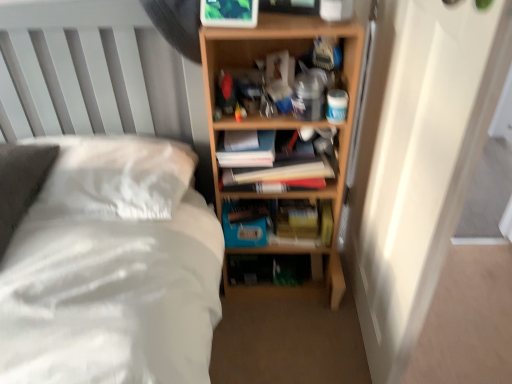
Question: From the image's perspective, is white soft bed at center under blue matte paperback book at center?

Choices:
 (A) no
 (B) yes

Answer: (B)

Question: Is white soft bed at center further to camera compared to blue matte paperback book at center?

Choices:
 (A) yes
 (B) no

Answer: (B)

Question: Is white soft bed at center bigger than blue matte paperback book at center?

Choices:
 (A) no
 (B) yes

Answer: (B)

Question: From a real-world perspective, does white soft bed at center sit lower than blue matte paperback book at center?

Choices:
 (A) no
 (B) yes

Answer: (A)

Question: Considering the relative sizes of white soft bed at center and blue matte paperback book at center in the image provided, is white soft bed at center taller than blue matte paperback book at center?

Choices:
 (A) yes
 (B) no

Answer: (A)

Question: Is blue matte paperback book at center at the back of white soft bed at center?

Choices:
 (A) no
 (B) yes

Answer: (A)

Question: Is white soft bed at center positioned behind wooden bookshelf at center?

Choices:
 (A) yes
 (B) no

Answer: (B)

Question: Is white soft bed at center bigger than wooden bookshelf at center?

Choices:
 (A) yes
 (B) no

Answer: (A)

Question: From the image's perspective, is white soft bed at center located above wooden bookshelf at center?

Choices:
 (A) yes
 (B) no

Answer: (B)

Question: Are white soft bed at center and wooden bookshelf at center located far from each other?

Choices:
 (A) yes
 (B) no

Answer: (B)

Question: Does white soft bed at center touch wooden bookshelf at center?

Choices:
 (A) no
 (B) yes

Answer: (A)

Question: Does white soft bed at center have a smaller size compared to wooden bookshelf at center?

Choices:
 (A) yes
 (B) no

Answer: (B)

Question: Does hardcover books at center lie behind white soft bed at center?

Choices:
 (A) yes
 (B) no

Answer: (A)